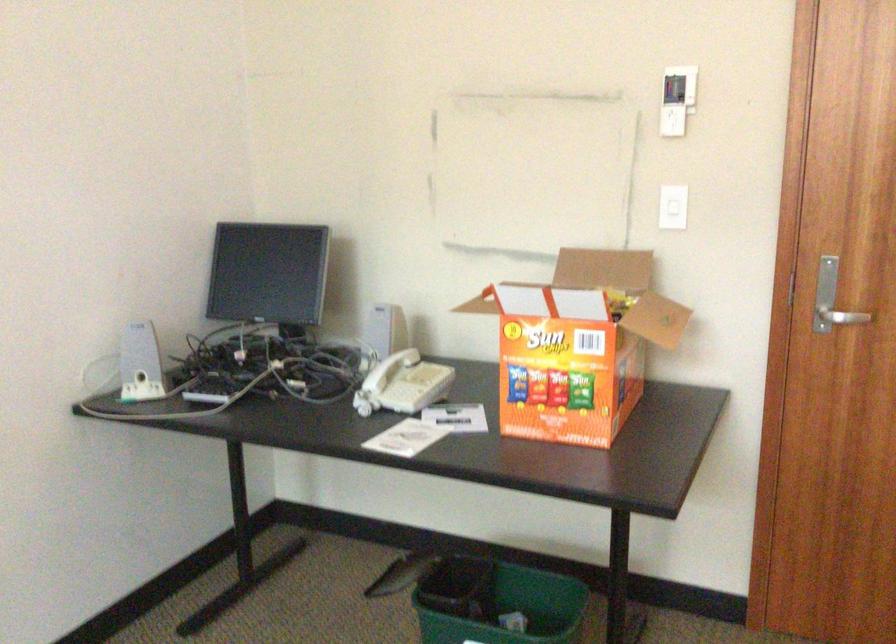
Which object does [498,603] point to?

It corresponds to the green trash can in the image.